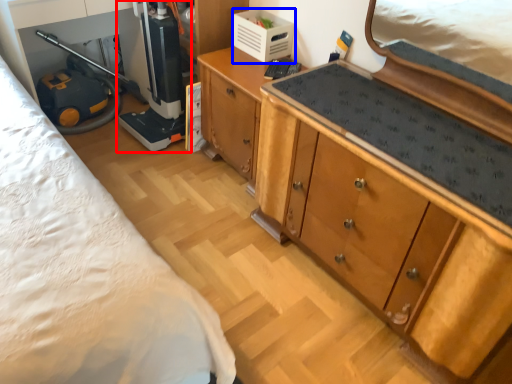
Question: Which object appears closest to the camera in this image, appliance (highlighted by a red box) or appliance (highlighted by a blue box)?

Choices:
 (A) appliance
 (B) appliance

Answer: (A)